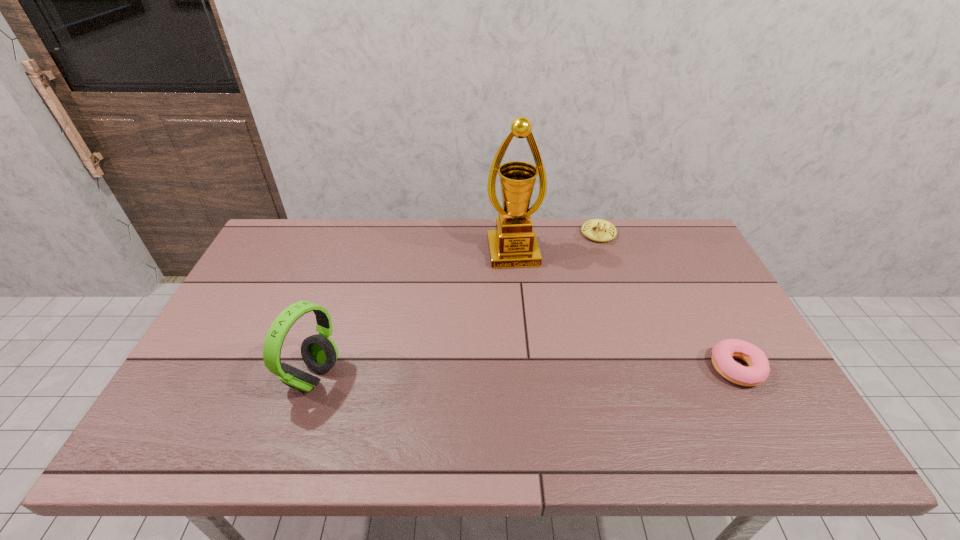
Where is `the third shortest object`? This screenshot has height=540, width=960. the third shortest object is located at coordinates (319, 352).

Locate an element on the screen. headset is located at coordinates (319, 352).

I want to click on the shortest object, so click(x=758, y=371).

Identify the location of doughnut. (758, 371).

Where is `the second object from left to right`? This screenshot has height=540, width=960. the second object from left to right is located at coordinates (513, 244).

You are a GUI agent. You are given a task and a screenshot of the screen. Output one action in this format:
    pyautogui.click(x=<x>, y=<y>)
    Task: Click on the tallest object
    Image resolution: width=960 pixels, height=540 pixels.
    Given the screenshot: What is the action you would take?
    pyautogui.click(x=513, y=244)

Where is `the second shortest object`? The width and height of the screenshot is (960, 540). the second shortest object is located at coordinates (600, 235).

Locate an element on the screen. This screenshot has height=540, width=960. duckling is located at coordinates (600, 235).

Where is `vacant space located 0.290m on the right of the second tallest object`? The height and width of the screenshot is (540, 960). vacant space located 0.290m on the right of the second tallest object is located at coordinates point(455,375).

Where is `vacant space positioned 0.220m on the left of the shortest object`? The image size is (960, 540). vacant space positioned 0.220m on the left of the shortest object is located at coordinates (624, 369).